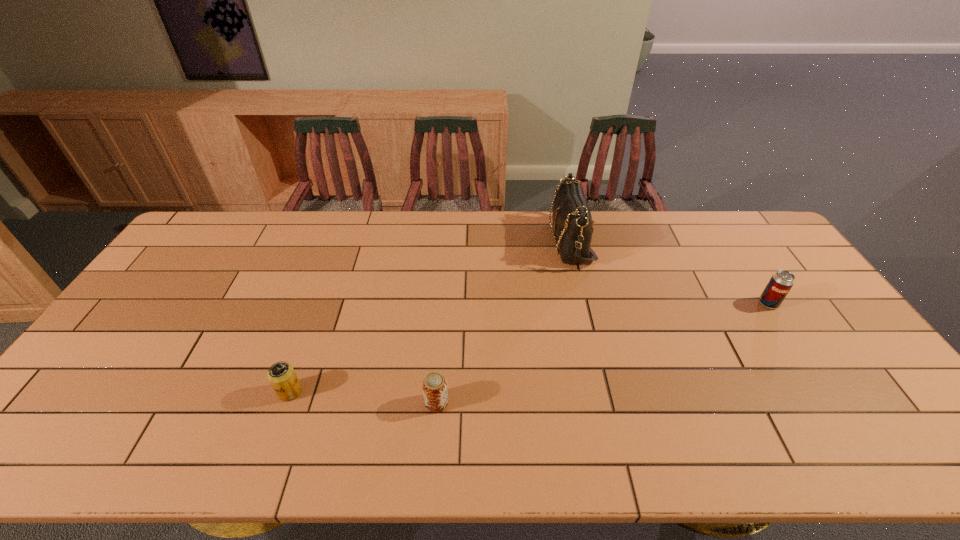
Locate an element on the screen. The image size is (960, 540). vacant point located on the back of the leftmost object is located at coordinates click(312, 330).

Identify the location of vacant space located on the right of the second object from left to right. (515, 402).

You are a GUI agent. You are given a task and a screenshot of the screen. Output one action in this format:
    pyautogui.click(x=<x>, y=<y>)
    Task: Click on the object located in the far edge section of the desktop
    
    Given the screenshot: What is the action you would take?
    pyautogui.click(x=572, y=220)

Identify the location of object that is at the right edge. pos(781,282).

In the image, there is a desktop. Identify the location of vacant area at the far edge. (313, 211).

Locate an element on the screen. The width and height of the screenshot is (960, 540). free space at the near edge of the desktop is located at coordinates (102, 444).

Identify the location of vacant region at the left edge. (97, 390).

Find the location of a particular element. The width and height of the screenshot is (960, 540). free point at the right edge is located at coordinates (876, 410).

Identify the location of free space at the far right corner. The image size is (960, 540). (741, 217).

In order to click on free point at the near right corner in this screenshot , I will do `click(910, 429)`.